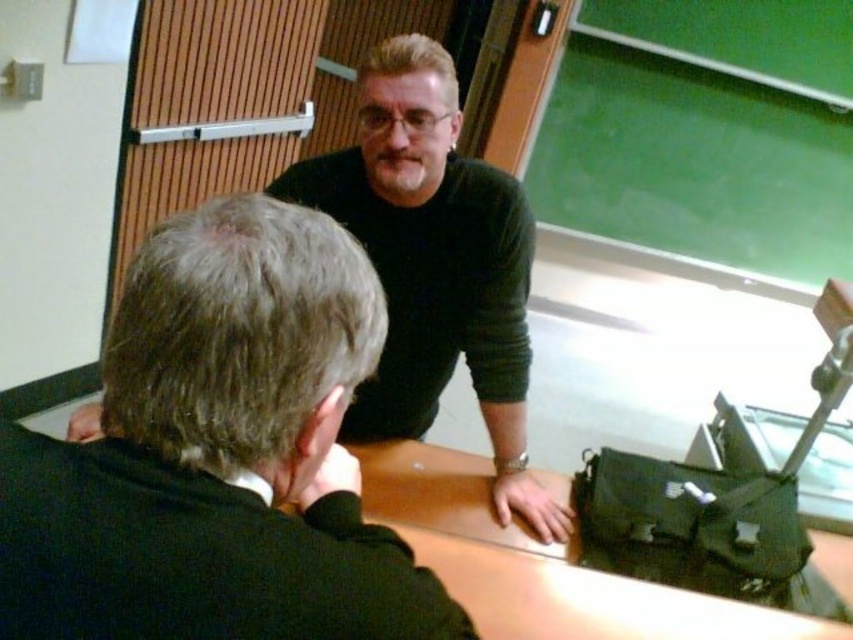
Question: Is dark green sweater at upper center further to camera compared to black matte sweater at upper center?

Choices:
 (A) no
 (B) yes

Answer: (A)

Question: Which object is farther from the camera taking this photo?

Choices:
 (A) dark green sweater at upper center
 (B) black matte sweater at upper center

Answer: (B)

Question: Is dark green sweater at upper center to the right of black matte sweater at upper center from the viewer's perspective?

Choices:
 (A) no
 (B) yes

Answer: (A)

Question: Where is dark green sweater at upper center located in relation to black matte sweater at upper center in the image?

Choices:
 (A) right
 (B) left

Answer: (B)